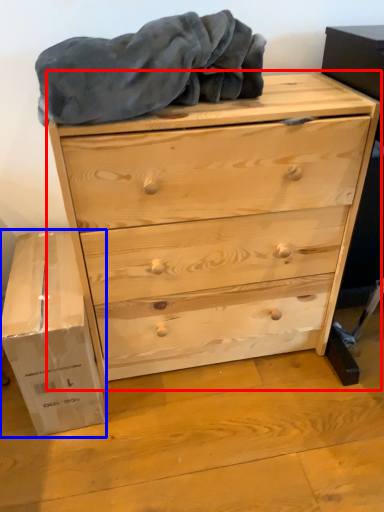
Question: Which object appears farthest to the camera in this image, chest of drawers (highlighted by a red box) or cardboard box (highlighted by a blue box)?

Choices:
 (A) chest of drawers
 (B) cardboard box

Answer: (B)